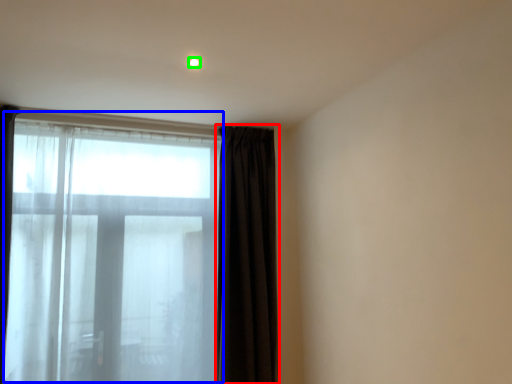
Question: Considering the real-world distances, which object is farthest from curtain (highlighted by a red box)? bay window (highlighted by a blue box) or light (highlighted by a green box)?

Choices:
 (A) bay window
 (B) light

Answer: (B)